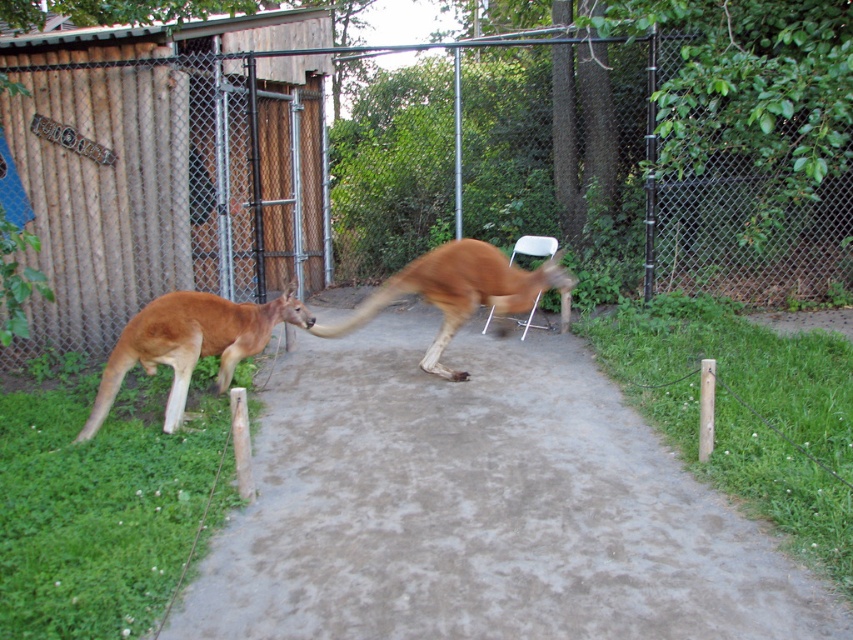
Question: Which point is farther to the camera?

Choices:
 (A) (432, 365)
 (B) (674, 266)
 (C) (532, 474)

Answer: (B)

Question: Which point is farther from the camera taking this photo?

Choices:
 (A) (428, 300)
 (B) (497, 118)
 (C) (155, 358)
 (D) (456, 627)

Answer: (B)

Question: Does brown furry kangaroo at left appear under brown furry kangaroo at center?

Choices:
 (A) no
 (B) yes

Answer: (B)

Question: Which of the following is the farthest from the observer?

Choices:
 (A) (289, 422)
 (B) (430, 205)

Answer: (B)

Question: Does brown concrete pavement at center appear over metallic chain-link fence at center?

Choices:
 (A) yes
 (B) no

Answer: (B)

Question: Does brown concrete pavement at center appear under metallic chain-link fence at center?

Choices:
 (A) yes
 (B) no

Answer: (A)